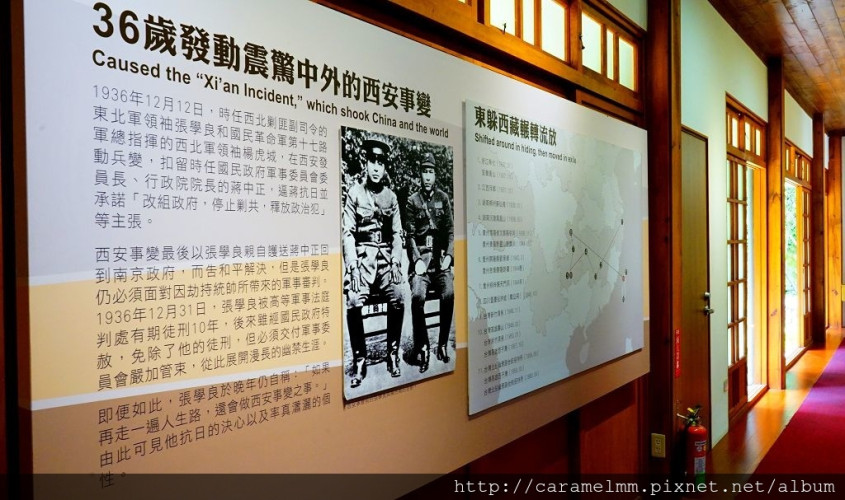
Locate an element on the screen. doors is located at coordinates (736, 273), (816, 282), (792, 299), (762, 308).